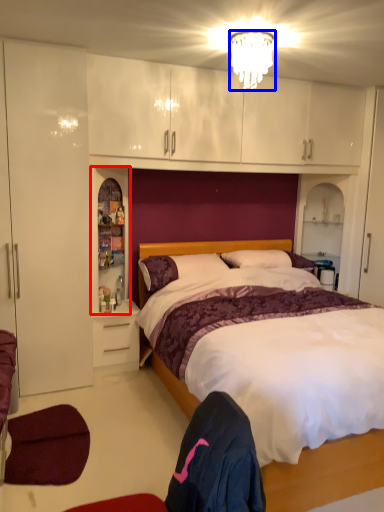
Question: Which point is closer to the camera, cabinet (highlighted by a red box) or lamp (highlighted by a blue box)?

Choices:
 (A) cabinet
 (B) lamp

Answer: (B)